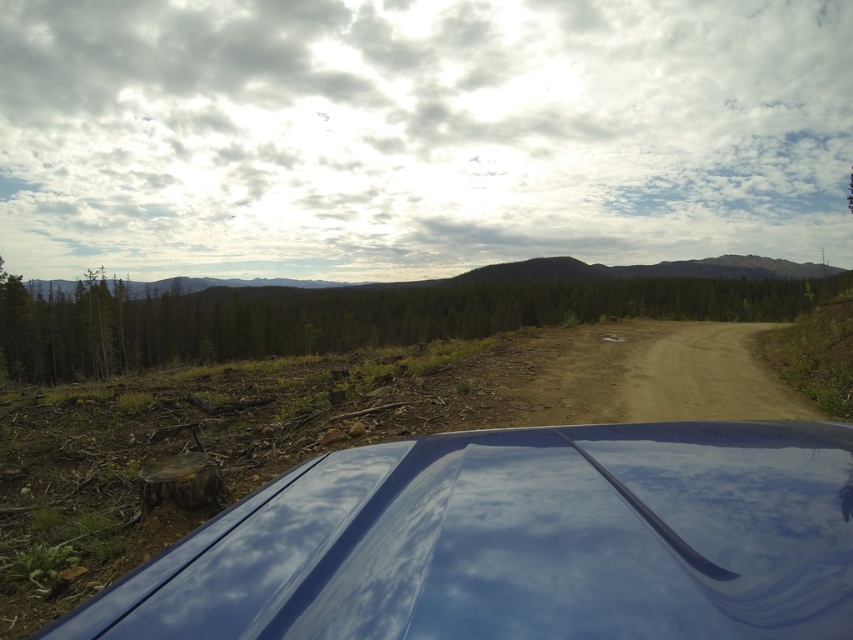
You are standing at the point closest to the blue vehicle. Which point, point [811,628] or point [170,336], is closer to you?

Point [811,628] is in front of point [170,336], so the point closer to you is point [811,628].

You are standing near the glossy blue car at lower center and want to walk towards the green matte tree at center. Which direction should you move to get closer to the tree?

The glossy blue car at lower center is closer to the viewer than the green matte tree at center, so to walk towards the green matte tree at center, you should move forward away from the car.

You are standing near the glossy blue car at lower center and want to take a photo of the green matte tree at center. Since the car is in the way, which direction should you move to get a clear shot of the tree without the car blocking it?

The glossy blue car at lower center is positioned under the green matte tree at center. To avoid the car blocking the view, you should move to the right side of the car so that the tree is no longer obscured.